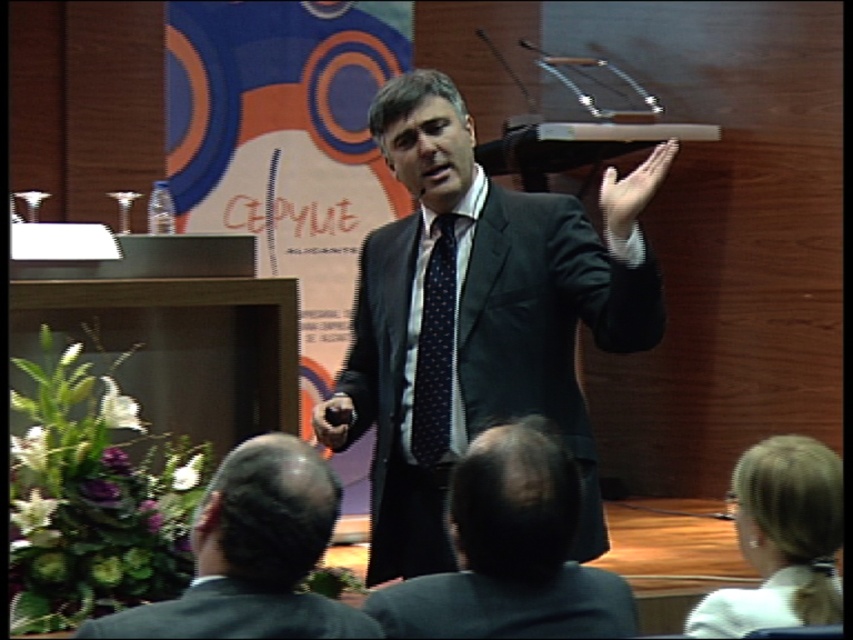
Who is higher up, dark gray suit at lower left or blonde hair at upper right?

dark gray suit at lower left

Does dark gray suit at lower left appear under blonde hair at upper right?

No, dark gray suit at lower left is not below blonde hair at upper right.

Does point (215, 577) come in front of point (744, 451)?

Yes.

At what (x,y) coordinates should I click in order to perform the action: click on dark gray suit at lower left. Please return your answer as a coordinate pair (x, y). Looking at the image, I should click on (253, 554).

Which of these two, blonde hair at upper right or dark blue dotted fabric tie at center, stands shorter?

With less height is blonde hair at upper right.

Is blonde hair at upper right positioned in front of dark blue dotted fabric tie at center?

Yes, it is.

Where is `blonde hair at upper right`? The image size is (853, 640). blonde hair at upper right is located at coordinates (780, 540).

Does black suit at center have a lesser width compared to matte black hand at upper center?

Incorrect, black suit at center's width is not less than matte black hand at upper center's.

Is black suit at center shorter than matte black hand at upper center?

No.

Who is more distant from viewer, (426, 589) or (599, 198)?

The point (599, 198) is more distant.

I want to click on black suit at center, so click(509, 552).